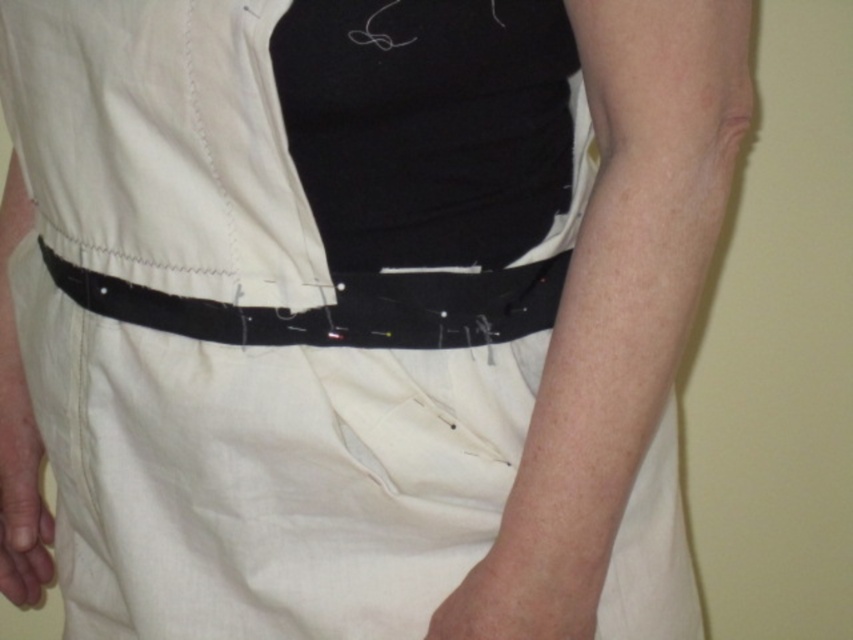
You are a tailor working on a garment. You notice the black fabric belt at center and the smooth beige hand at lower left. Which object is closer to you as you work on the garment?

The black fabric belt at center is closer to you because it is in front of the smooth beige hand at lower left.